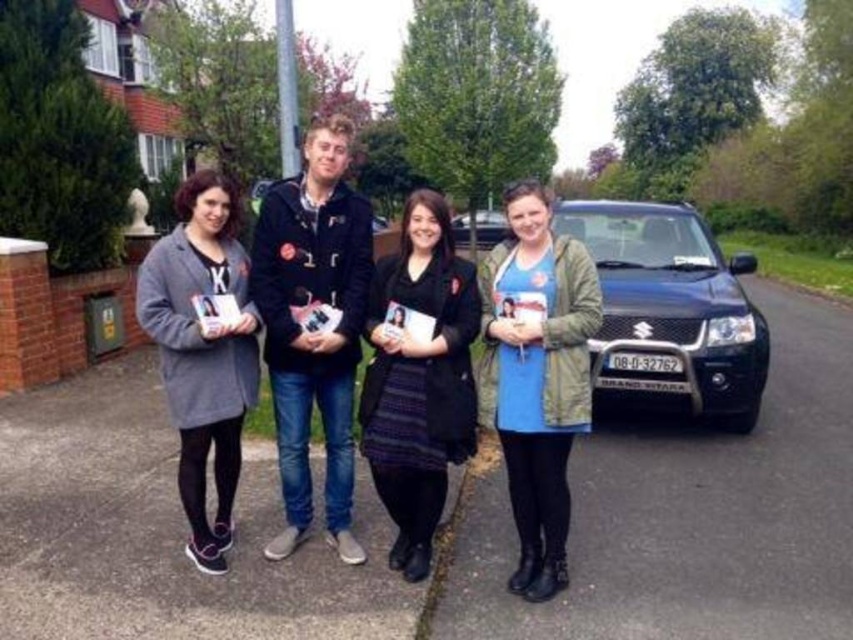
Find the location of a particular element. dark purple textured dress at center is located at coordinates (419, 378).

Is dark purple textured dress at center positioned behind gray wool coat at left?

Yes.

Does point (461, 348) lie behind point (183, 397)?

No, (461, 348) is in front of (183, 397).

The width and height of the screenshot is (853, 640). In order to click on dark purple textured dress at center in this screenshot , I will do `click(419, 378)`.

Can you confirm if matte black jacket at center is positioned to the left of metallic pole at upper center?

No, matte black jacket at center is not to the left of metallic pole at upper center.

Between point (440, 468) and point (288, 19), which one is positioned behind?

The point (288, 19) is behind.

The height and width of the screenshot is (640, 853). What do you see at coordinates (357, 340) in the screenshot?
I see `matte black jacket at center` at bounding box center [357, 340].

Where is `matte black jacket at center`? Image resolution: width=853 pixels, height=640 pixels. matte black jacket at center is located at coordinates (357, 340).

Can you confirm if matte black jacket at center is shorter than blue matte dress at center?

Incorrect, matte black jacket at center's height does not fall short of blue matte dress at center's.

At what (x,y) coordinates should I click in order to perform the action: click on matte black jacket at center. Please return your answer as a coordinate pair (x, y). The width and height of the screenshot is (853, 640). Looking at the image, I should click on (357, 340).